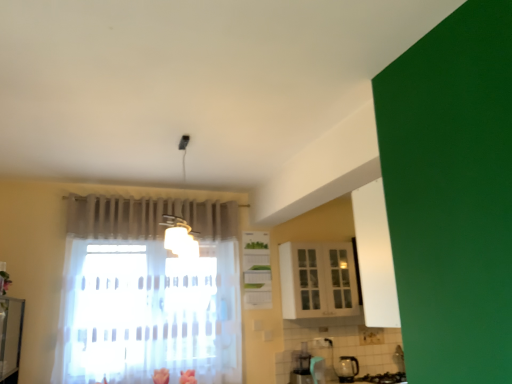
Measure the distance between transparent glass kettle at lower right and camera.

transparent glass kettle at lower right and camera are 4.23 meters apart.

Locate an element on the screen. This screenshot has height=384, width=512. transparent glass kettle at lower right is located at coordinates (347, 369).

Describe the element at coordinates (318, 280) in the screenshot. I see `white glossy cabinet at upper center, the 2th cabinetry in the left-to-right sequence` at that location.

The width and height of the screenshot is (512, 384). I want to click on transparent glass kettle at lower right, so click(347, 369).

Considering the relative sizes of white glossy cabinet at upper center, acting as the first cabinetry starting from the right, and white glossy cabinet at center, the 1th cabinetry viewed from the left, in the image provided, is white glossy cabinet at upper center, acting as the first cabinetry starting from the right, smaller than white glossy cabinet at center, the 1th cabinetry viewed from the left,?

No.

How far apart are white glossy cabinet at upper center, acting as the first cabinetry starting from the right, and white glossy cabinet at center, the 2th cabinetry viewed from the right?

white glossy cabinet at upper center, acting as the first cabinetry starting from the right, and white glossy cabinet at center, the 2th cabinetry viewed from the right, are 43.30 centimeters apart.

Identify the location of cabinetry that is above the white glossy cabinet at upper center, acting as the first cabinetry starting from the right (from a real-world perspective). click(257, 270).

From the image's perspective, is white glossy cabinet at upper center, acting as the first cabinetry starting from the right, beneath white glossy cabinet at center, the 2th cabinetry viewed from the right?

Yes, from the image's perspective, white glossy cabinet at upper center, acting as the first cabinetry starting from the right, is beneath white glossy cabinet at center, the 2th cabinetry viewed from the right.

Considering the sizes of objects white glossy cabinet at center, the 2th cabinetry viewed from the right, and white glossy cabinet at upper center, acting as the first cabinetry starting from the right, in the image provided, who is bigger, white glossy cabinet at center, the 2th cabinetry viewed from the right, or white glossy cabinet at upper center, acting as the first cabinetry starting from the right,?

Bigger between the two is white glossy cabinet at upper center, acting as the first cabinetry starting from the right.

Considering the sizes of white glossy cabinet at center, the 1th cabinetry viewed from the left, and white glossy cabinet at upper center, acting as the first cabinetry starting from the right, in the image, is white glossy cabinet at center, the 1th cabinetry viewed from the left, wider or thinner than white glossy cabinet at upper center, acting as the first cabinetry starting from the right,?

Clearly, white glossy cabinet at center, the 1th cabinetry viewed from the left, has less width compared to white glossy cabinet at upper center, acting as the first cabinetry starting from the right.

From a real-world perspective, does white glossy cabinet at center, the 1th cabinetry viewed from the left, stand above white glossy cabinet at upper center, the 2th cabinetry in the left-to-right sequence?

Correct, in the physical world, white glossy cabinet at center, the 1th cabinetry viewed from the left, is higher than white glossy cabinet at upper center, the 2th cabinetry in the left-to-right sequence.

You are a GUI agent. You are given a task and a screenshot of the screen. Output one action in this format:
    pyautogui.click(x=<x>, y=<y>)
    Task: Click on the cabinetry above the white glossy cabinet at upper center, the 2th cabinetry in the left-to-right sequence (from the image's perspective)
    This screenshot has width=512, height=384.
    Given the screenshot: What is the action you would take?
    pyautogui.click(x=257, y=270)

Considering the positions of point (335, 371) and point (262, 261), is point (335, 371) closer or farther from the camera than point (262, 261)?

Point (335, 371) appears to be closer to the viewer than point (262, 261).

From the image's perspective, relative to white glossy cabinet at center, the 1th cabinetry viewed from the left, is transparent glass kettle at lower right above or below?

transparent glass kettle at lower right is situated lower than white glossy cabinet at center, the 1th cabinetry viewed from the left, in the image.

Does transparent glass kettle at lower right have a larger size compared to white glossy cabinet at center, the 1th cabinetry viewed from the left?

No.

Can you confirm if transparent glass kettle at lower right is wider than white glossy cabinet at center, the 1th cabinetry viewed from the left?

Correct, the width of transparent glass kettle at lower right exceeds that of white glossy cabinet at center, the 1th cabinetry viewed from the left.

Where is `appliance behind the white glossy cabinet at upper center, acting as the first cabinetry starting from the right`? appliance behind the white glossy cabinet at upper center, acting as the first cabinetry starting from the right is located at coordinates (347, 369).

Is transparent glass kettle at lower right in front of or behind white glossy cabinet at upper center, acting as the first cabinetry starting from the right, in the image?

In the image, transparent glass kettle at lower right appears behind white glossy cabinet at upper center, acting as the first cabinetry starting from the right.

How many degrees apart are the facing directions of transparent glass kettle at lower right and white glossy cabinet at upper center, acting as the first cabinetry starting from the right?

0.002 degrees.

From the image's perspective, does transparent glass kettle at lower right appear higher than white glossy cabinet at upper center, the 2th cabinetry in the left-to-right sequence?

No, from the image's perspective, transparent glass kettle at lower right is not above white glossy cabinet at upper center, the 2th cabinetry in the left-to-right sequence.

Considering the positions of objects white glossy cabinet at center, the 1th cabinetry viewed from the left, and transparent glass kettle at lower right in the image provided, who is more to the left, white glossy cabinet at center, the 1th cabinetry viewed from the left, or transparent glass kettle at lower right?

From the viewer's perspective, white glossy cabinet at center, the 1th cabinetry viewed from the left, appears more on the left side.

From a real-world perspective, who is located higher, white glossy cabinet at center, the 2th cabinetry viewed from the right, or transparent glass kettle at lower right?

In real-world perspective, white glossy cabinet at center, the 2th cabinetry viewed from the right, is above.

The width and height of the screenshot is (512, 384). In the image, there is a white glossy cabinet at center, the 2th cabinetry viewed from the right. What are the coordinates of `appliance below it (from a real-world perspective)` in the screenshot? It's located at (347, 369).

From the image's perspective, is white glossy cabinet at center, the 2th cabinetry viewed from the right, over transparent glass kettle at lower right?

Yes, from the image's perspective, white glossy cabinet at center, the 2th cabinetry viewed from the right, is on top of transparent glass kettle at lower right.

Can you tell me how much white glossy cabinet at upper center, the 2th cabinetry in the left-to-right sequence, and transparent glass kettle at lower right differ in facing direction?

They differ by 0.002 degrees in their facing directions.

Does white glossy cabinet at upper center, the 2th cabinetry in the left-to-right sequence, have a lesser width compared to transparent glass kettle at lower right?

Incorrect, the width of white glossy cabinet at upper center, the 2th cabinetry in the left-to-right sequence, is not less than that of transparent glass kettle at lower right.

There is a transparent glass kettle at lower right. Identify the location of the 1st cabinetry above it (from a real-world perspective). (318, 280).

Is white glossy cabinet at upper center, acting as the first cabinetry starting from the right, to the right of transparent glass kettle at lower right from the viewer's perspective?

No, white glossy cabinet at upper center, acting as the first cabinetry starting from the right, is not to the right of transparent glass kettle at lower right.

This screenshot has width=512, height=384. What are the coordinates of `cabinetry that appears below the white glossy cabinet at center, the 2th cabinetry viewed from the right (from the image's perspective)` in the screenshot? It's located at (318, 280).

At what (x,y) coordinates should I click in order to perform the action: click on cabinetry that is under the white glossy cabinet at center, the 2th cabinetry viewed from the right (from a real-world perspective). Please return your answer as a coordinate pair (x, y). This screenshot has width=512, height=384. Looking at the image, I should click on (318, 280).

From the image, which object appears to be farther from transparent glass kettle at lower right, white glossy cabinet at upper center, the 2th cabinetry in the left-to-right sequence, or white glossy cabinet at center, the 2th cabinetry viewed from the right?

Based on the image, white glossy cabinet at center, the 2th cabinetry viewed from the right, appears to be further to transparent glass kettle at lower right.

When comparing their distances from white glossy cabinet at center, the 1th cabinetry viewed from the left, does white glossy cabinet at upper center, acting as the first cabinetry starting from the right, or transparent glass kettle at lower right seem further?

transparent glass kettle at lower right lies further to white glossy cabinet at center, the 1th cabinetry viewed from the left, than the other object.

Looking at the image, which one is located further to white glossy cabinet at center, the 1th cabinetry viewed from the left, transparent glass kettle at lower right or white glossy cabinet at upper center, the 2th cabinetry in the left-to-right sequence?

The object further to white glossy cabinet at center, the 1th cabinetry viewed from the left, is transparent glass kettle at lower right.

Based on their spatial positions, is white glossy cabinet at center, the 1th cabinetry viewed from the left, or white glossy cabinet at upper center, the 2th cabinetry in the left-to-right sequence, closer to transparent glass kettle at lower right?

white glossy cabinet at upper center, the 2th cabinetry in the left-to-right sequence.

Based on the photo, which object lies further to the anchor point white glossy cabinet at upper center, the 2th cabinetry in the left-to-right sequence, white glossy cabinet at center, the 2th cabinetry viewed from the right, or transparent glass kettle at lower right?

transparent glass kettle at lower right is further to white glossy cabinet at upper center, the 2th cabinetry in the left-to-right sequence.

Looking at the image, which one is located further to white glossy cabinet at upper center, acting as the first cabinetry starting from the right, transparent glass kettle at lower right or white glossy cabinet at center, the 1th cabinetry viewed from the left?

transparent glass kettle at lower right is positioned further to the anchor white glossy cabinet at upper center, acting as the first cabinetry starting from the right.

Locate an element on the screen. The width and height of the screenshot is (512, 384). cabinetry between white glossy cabinet at center, the 2th cabinetry viewed from the right, and transparent glass kettle at lower right from top to bottom is located at coordinates (318, 280).